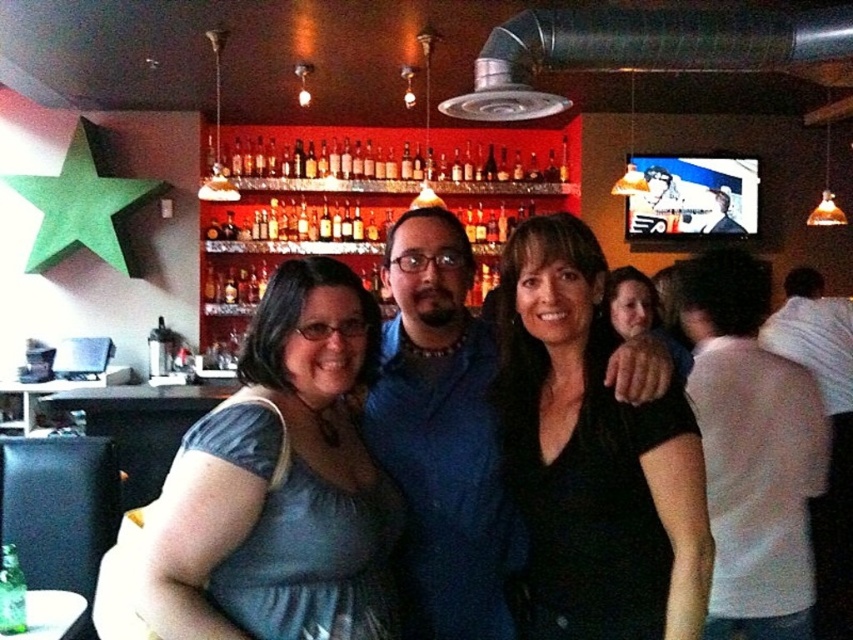
You are a photographer taking a picture of the scene described. You need to ensure that the white cotton shirt at right is centered in the frame. Given its current position at coordinates, is it already centered? Please explain your reasoning.

The white cotton shirt at right is located at coordinates [752,449]. Since the center of the frame is typically at coordinates [426,320], the shirt is positioned to the right and above the center point. Therefore, it is not currently centered in the frame.

Looking at this image, you are a photographer trying to capture a group photo in this bar. You notice the shiny blue dress at center and the translucent glass bottles at center. Which object is narrower when viewed from your camera angle?

The shiny blue dress at center is narrower than the translucent glass bottles at center.

You are a photographer trying to capture a group photo in a bar. You notice two people in the foreground wearing the shiny blue dress at center and the black matte shirt at center. If you want to ensure both subjects are in focus, what minimum focusing distance should your camera have between them?

The shiny blue dress at center and the black matte shirt at center are 14.28 inches apart. To ensure both are in focus, the camera should have a minimum focusing distance of at least 14.28 inches between them.